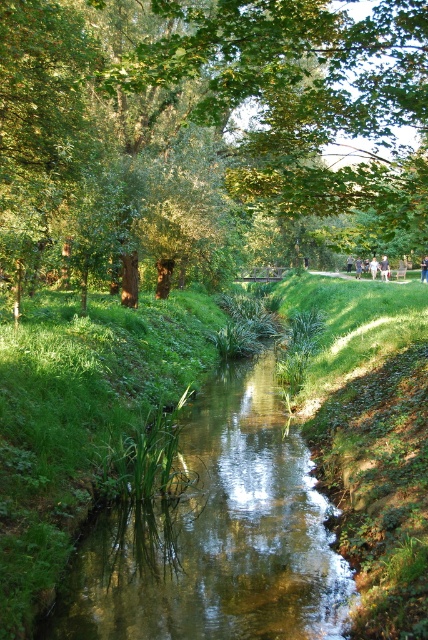
Question: Which object is the farthest from the green leafy tree at upper center?

Choices:
 (A) blue denim jeans at center
 (B) light blue denim shorts at center
 (C) clear water stream at center

Answer: (B)

Question: Which of the following is the farthest from the observer?

Choices:
 (A) blue denim jeans at center
 (B) clear water stream at center
 (C) green leafy tree at upper center
 (D) light blue denim shorts at center

Answer: (D)

Question: Is clear water stream at center below light blue denim shorts at center?

Choices:
 (A) no
 (B) yes

Answer: (B)

Question: Estimate the real-world distances between objects in this image. Which object is closer to the clear water stream at center?

Choices:
 (A) blue denim jeans at center
 (B) light blue denim shorts at center
 (C) green leafy tree at upper center

Answer: (C)

Question: Is green leafy tree at upper center smaller than clear water stream at center?

Choices:
 (A) yes
 (B) no

Answer: (B)

Question: Does clear water stream at center have a smaller size compared to blue denim jeans at center?

Choices:
 (A) no
 (B) yes

Answer: (B)